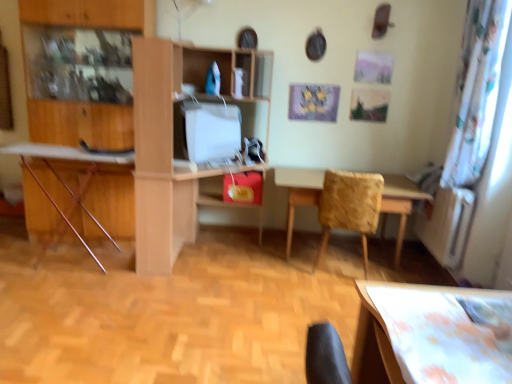
Describe the element at coordinates (174, 141) in the screenshot. Image resolution: width=512 pixels, height=384 pixels. I see `light wood/wooden desk at center` at that location.

Identify the location of wooden chair at center. (x=349, y=206).

Describe the element at coordinates (349, 206) in the screenshot. I see `wooden chair at center` at that location.

What do you see at coordinates (63, 180) in the screenshot? The width and height of the screenshot is (512, 384). I see `wooden ironing board at left` at bounding box center [63, 180].

At what (x,y) coordinates should I click in order to perform the action: click on wooden dresser at left. Please return your answer as a coordinate pair (x, y). This screenshot has height=384, width=512. Looking at the image, I should click on (x=82, y=69).

You are a GUI agent. You are given a task and a screenshot of the screen. Output one action in this format:
    pyautogui.click(x=<x>, y=<y>)
    Task: Click on the computer desk above the wooden textured table at center (from a real-world perspective)
    The width and height of the screenshot is (512, 384).
    Given the screenshot: What is the action you would take?
    pyautogui.click(x=63, y=180)

Which object is closer to the camera taking this photo, wooden textured table at center or wooden ironing board at left?

wooden ironing board at left is in front.

Which of these two, wooden textured table at center or wooden ironing board at left, is bigger?

wooden textured table at center.

Between wooden dresser at left and white glossy computer monitor at center, which one has larger size?

Bigger between the two is wooden dresser at left.

Considering the positions of points (114, 59) and (175, 113), is point (114, 59) farther from camera compared to point (175, 113)?

Yes, it is behind point (175, 113).

Can you see wooden dresser at left touching white glossy computer monitor at center?

They are not placed beside each other.

The height and width of the screenshot is (384, 512). I want to click on computer monitor lying behind the wooden dresser at left, so click(x=206, y=131).

Considering the relative sizes of wooden chair at center and wooden dresser at left in the image provided, is wooden chair at center thinner than wooden dresser at left?

No, wooden chair at center is not thinner than wooden dresser at left.

Based on the photo, considering the relative positions of wooden chair at center and wooden dresser at left in the image provided, is wooden chair at center to the left of wooden dresser at left from the viewer's perspective?

In fact, wooden chair at center is to the right of wooden dresser at left.

Is wooden chair at center shorter than wooden dresser at left?

Yes.

Is light wood/wooden desk at center positioned far away from wooden dresser at left?

light wood/wooden desk at center is near wooden dresser at left, not far away.

In the image, is light wood/wooden desk at center on the left side or the right side of wooden dresser at left?

In the image, light wood/wooden desk at center appears on the right side of wooden dresser at left.

Where is `dresser that is above the light wood/wooden desk at center (from a real-world perspective)`? This screenshot has height=384, width=512. dresser that is above the light wood/wooden desk at center (from a real-world perspective) is located at coordinates (82, 69).

Is light wood/wooden desk at center positioned in front of wooden dresser at left?

Yes, it is.

Which object is positioned more to the left, wooden chair at center or wooden textured table at center?

wooden chair at center is more to the left.

Does wooden chair at center turn towards wooden textured table at center?

Yes, wooden chair at center faces towards wooden textured table at center.

What's the angular difference between wooden chair at center and wooden textured table at center's facing directions?

The angle between the facing direction of wooden chair at center and the facing direction of wooden textured table at center is 169 degrees.

Is wooden chair at center bigger than wooden textured table at center?

Incorrect, wooden chair at center is not larger than wooden textured table at center.

Looking at this image, is light wood/wooden desk at center further to camera compared to wooden textured table at center?

No, light wood/wooden desk at center is closer to the camera.

Does light wood/wooden desk at center turn towards wooden textured table at center?

No, light wood/wooden desk at center does not turn towards wooden textured table at center.

Could wooden textured table at center be considered to be inside light wood/wooden desk at center?

No, wooden textured table at center is not inside light wood/wooden desk at center.

Where is `table below the light wood/wooden desk at center (from the image's perspective)`? The height and width of the screenshot is (384, 512). table below the light wood/wooden desk at center (from the image's perspective) is located at coordinates (298, 192).

Considering the points (411, 205) and (260, 63), which point is in front, point (411, 205) or point (260, 63)?

The point (411, 205) is more forward.

In the scene shown: Looking at their sizes, would you say wooden textured table at center is wider or thinner than light wood/wooden desk at center?

Clearly, wooden textured table at center has less width compared to light wood/wooden desk at center.

Looking at this image, is wooden textured table at center turned away from light wood/wooden desk at center?

wooden textured table at center does not have its back to light wood/wooden desk at center.

From a real-world perspective, is wooden textured table at center under light wood/wooden desk at center?

Indeed, from a real-world perspective, wooden textured table at center is positioned beneath light wood/wooden desk at center.

Find the location of `computer desk above the wooden textured table at center (from the image's perspective)`. computer desk above the wooden textured table at center (from the image's perspective) is located at coordinates (63, 180).

The width and height of the screenshot is (512, 384). In order to click on computer monitor below the wooden dresser at left (from a real-world perspective) in this screenshot , I will do `click(206, 131)`.

Looking at the image, which one is located further to light wood/wooden desk at center, wooden dresser at left or white glossy computer monitor at center?

The object further to light wood/wooden desk at center is wooden dresser at left.

Considering their positions, is light wood/wooden desk at center positioned closer to wooden dresser at left than white glossy computer monitor at center?

Based on the image, light wood/wooden desk at center appears to be nearer to wooden dresser at left.

From the picture: Considering their positions, is light wood/wooden desk at center positioned closer to wooden textured table at center than white glossy computer monitor at center?

white glossy computer monitor at center is positioned closer to the anchor wooden textured table at center.

When comparing their distances from light wood/wooden desk at center, does wooden chair at center or wooden ironing board at left seem closer?

wooden ironing board at left is closer to light wood/wooden desk at center.

Based on the photo, which object lies further to the anchor point wooden textured table at center, light wood/wooden desk at center or wooden chair at center?

Among the two, light wood/wooden desk at center is located further to wooden textured table at center.

From the image, which object appears to be nearer to wooden textured table at center, wooden ironing board at left or wooden chair at center?

wooden chair at center is closer to wooden textured table at center.

In the scene shown: Estimate the real-world distances between objects in this image. Which object is further from wooden textured table at center, white glossy computer monitor at center or light wood/wooden desk at center?

light wood/wooden desk at center is positioned further to the anchor wooden textured table at center.

Looking at the image, which one is located closer to wooden chair at center, wooden textured table at center or light wood/wooden desk at center?

wooden textured table at center is positioned closer to the anchor wooden chair at center.

Locate an element on the screen. The height and width of the screenshot is (384, 512). chair between wooden dresser at left and wooden textured table at center is located at coordinates tap(349, 206).

The width and height of the screenshot is (512, 384). What are the coordinates of `computer monitor between wooden dresser at left and wooden textured table at center in the horizontal direction` in the screenshot? It's located at (206, 131).

Locate an element on the screen. The height and width of the screenshot is (384, 512). computer monitor between wooden ironing board at left and wooden chair at center in the horizontal direction is located at coordinates (206, 131).

You are a GUI agent. You are given a task and a screenshot of the screen. Output one action in this format:
    pyautogui.click(x=<x>, y=<y>)
    Task: Click on the dresser located between wooden ironing board at left and wooden textured table at center in the left-right direction
    
    Given the screenshot: What is the action you would take?
    pyautogui.click(x=82, y=69)